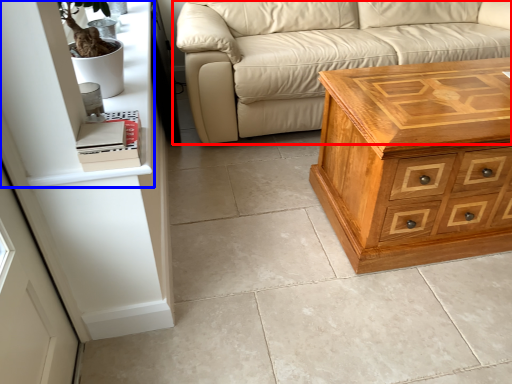
Question: Which of the following is the farthest to the observer, studio couch (highlighted by a red box) or shelf (highlighted by a blue box)?

Choices:
 (A) studio couch
 (B) shelf

Answer: (A)